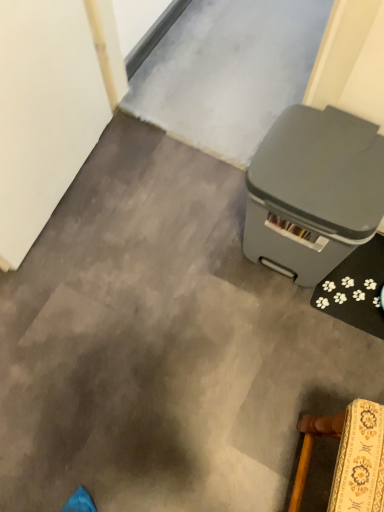
Where is `free space that is to the left of gray plastic waste bin at right`? The image size is (384, 512). free space that is to the left of gray plastic waste bin at right is located at coordinates (201, 247).